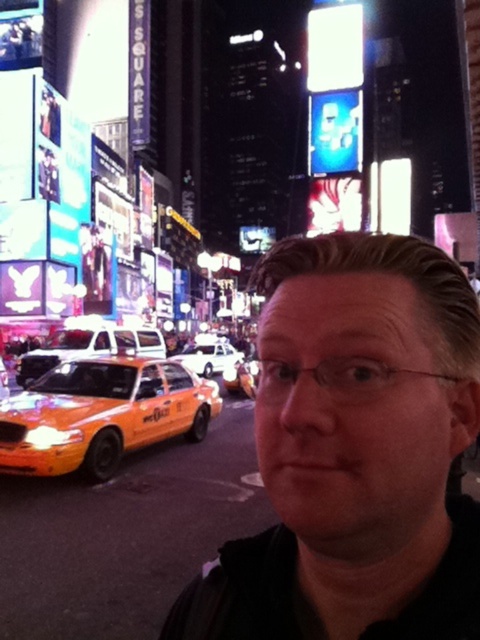
Question: Considering the real-world distances, which object is farthest from the yellow matte taxi at left?

Choices:
 (A) white glossy sedan at center
 (B) orange matte taxi at lower left

Answer: (B)

Question: Is yellow matte taxi at left to the left of white glossy sedan at center from the viewer's perspective?

Choices:
 (A) yes
 (B) no

Answer: (A)

Question: Considering the real-world distances, which object is farthest from the orange matte taxi at lower left?

Choices:
 (A) yellow matte taxi at left
 (B) white glossy sedan at center

Answer: (B)

Question: Does orange matte taxi at lower left appear under yellow matte taxi at left?

Choices:
 (A) yes
 (B) no

Answer: (A)

Question: Based on their relative distances, which object is nearer to the black matte man at center?

Choices:
 (A) yellow matte taxi at left
 (B) white glossy sedan at center

Answer: (A)

Question: Does orange matte taxi at lower left have a smaller size compared to white glossy sedan at center?

Choices:
 (A) no
 (B) yes

Answer: (A)